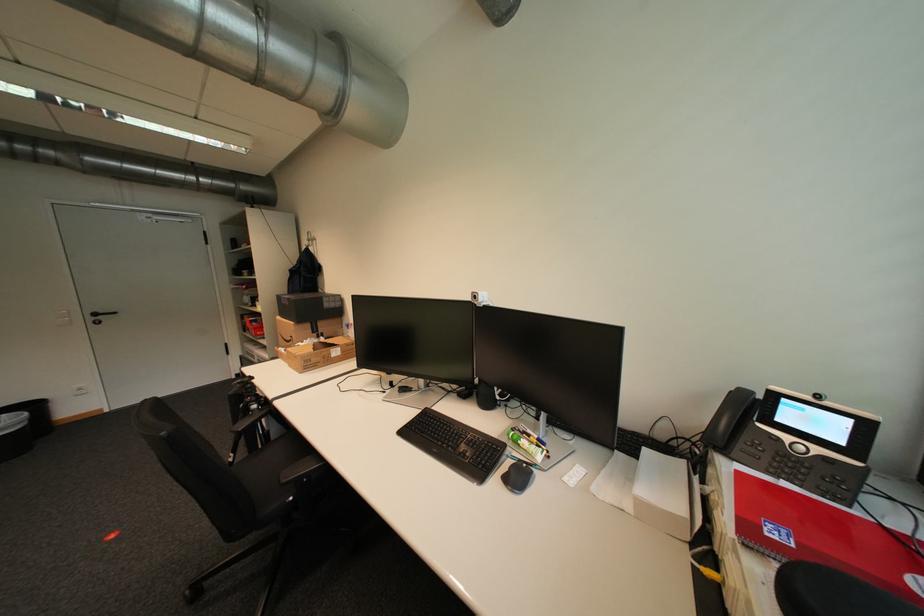
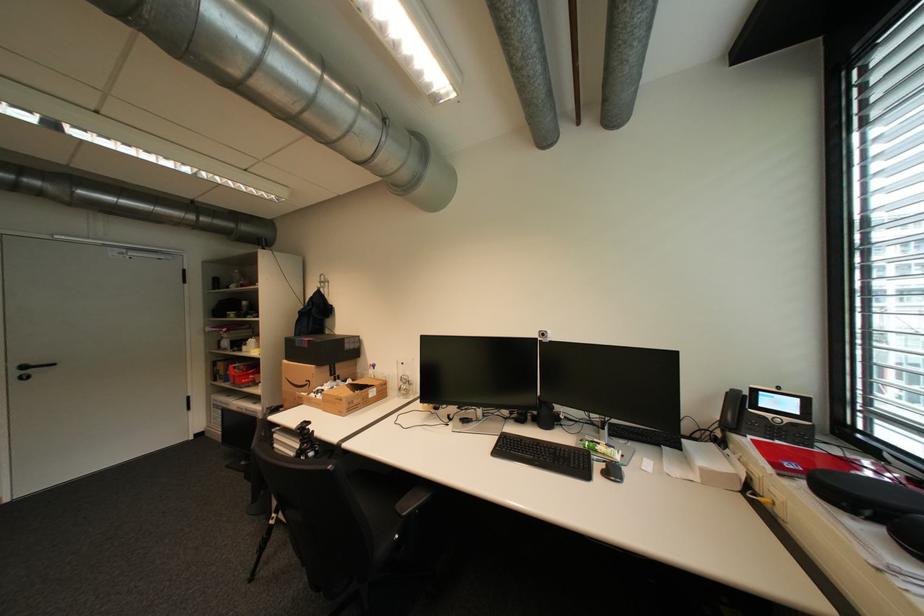
Locate, in the second image, the point that corresponds to pixel 481 294 in the first image.

(548, 331)